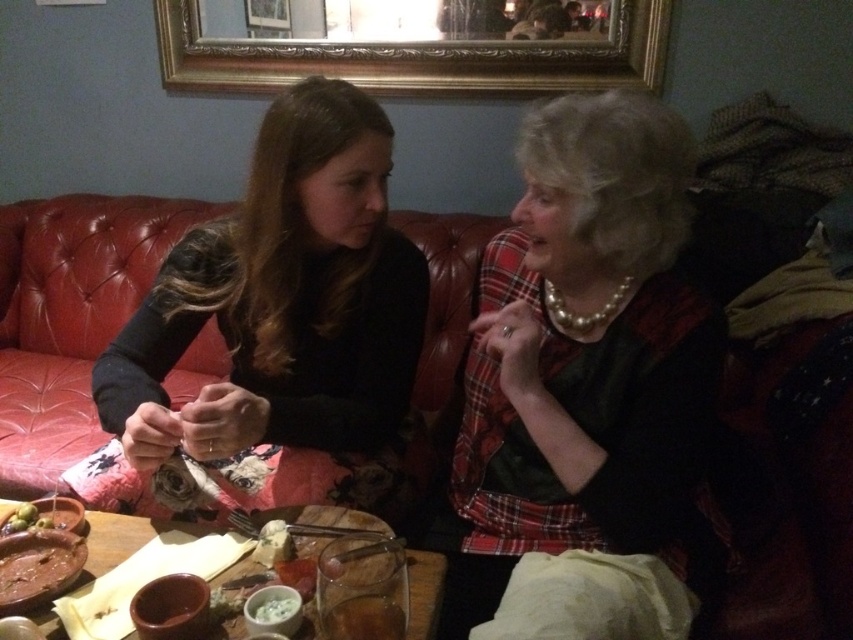
Question: Which point is closer to the camera?

Choices:
 (A) matte black sweater at left
 (B) wooden table at center

Answer: (B)

Question: Can you confirm if leather couch at center is bigger than gold ornate mirror at upper center?

Choices:
 (A) no
 (B) yes

Answer: (B)

Question: Which object is farther from the camera taking this photo?

Choices:
 (A) matte black sweater at left
 (B) white creamy sauce at center

Answer: (A)

Question: Observing the image, what is the correct spatial positioning of wooden table at center in reference to white creamy sauce at center?

Choices:
 (A) right
 (B) left

Answer: (B)

Question: Which object appears farthest from the camera in this image?

Choices:
 (A) white creamy sauce at center
 (B) wooden table at center

Answer: (A)

Question: Does gold ornate mirror at upper center have a larger size compared to white creamy sauce at center?

Choices:
 (A) yes
 (B) no

Answer: (A)